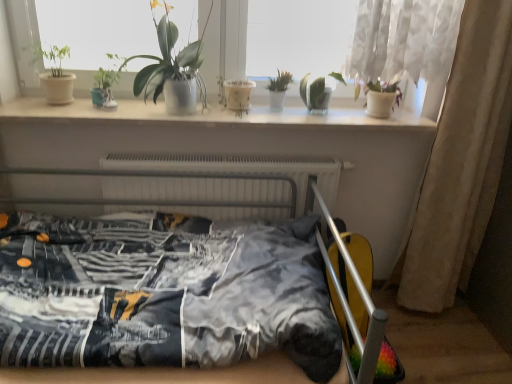
Identify the location of free space on the front side of green matte plant at center, the 4th houseplant from the left. The height and width of the screenshot is (384, 512). (269, 112).